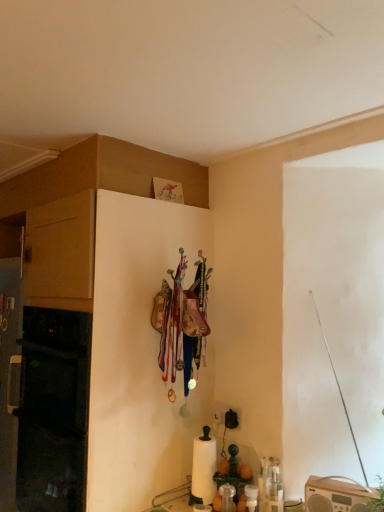
Question: Is matte wood cabinet at left surrounded by green leafy plant at lower right?

Choices:
 (A) yes
 (B) no

Answer: (B)

Question: Is green leafy plant at lower right oriented away from matte wood cabinet at left?

Choices:
 (A) yes
 (B) no

Answer: (B)

Question: From the image's perspective, does green leafy plant at lower right appear higher than matte wood cabinet at left?

Choices:
 (A) no
 (B) yes

Answer: (A)

Question: Considering the relative sizes of green leafy plant at lower right and matte wood cabinet at left in the image provided, is green leafy plant at lower right wider than matte wood cabinet at left?

Choices:
 (A) yes
 (B) no

Answer: (B)

Question: Is green leafy plant at lower right bigger than matte wood cabinet at left?

Choices:
 (A) no
 (B) yes

Answer: (A)

Question: Is green leafy plant at lower right smaller than matte wood cabinet at left?

Choices:
 (A) yes
 (B) no

Answer: (A)

Question: Considering the relative sizes of matte wood cabinet at left and green leafy plant at lower right in the image provided, is matte wood cabinet at left bigger than green leafy plant at lower right?

Choices:
 (A) yes
 (B) no

Answer: (A)

Question: Does matte wood cabinet at left have a greater height compared to green leafy plant at lower right?

Choices:
 (A) no
 (B) yes

Answer: (B)

Question: Is matte wood cabinet at left oriented towards green leafy plant at lower right?

Choices:
 (A) yes
 (B) no

Answer: (B)

Question: From a real-world perspective, is matte wood cabinet at left located higher than green leafy plant at lower right?

Choices:
 (A) no
 (B) yes

Answer: (B)

Question: Is matte wood cabinet at left to the right of green leafy plant at lower right from the viewer's perspective?

Choices:
 (A) no
 (B) yes

Answer: (A)

Question: Is matte wood cabinet at left with green leafy plant at lower right?

Choices:
 (A) yes
 (B) no

Answer: (B)

Question: In terms of height, does matte wood cabinet at left look taller or shorter compared to green leafy plant at lower right?

Choices:
 (A) short
 (B) tall

Answer: (B)